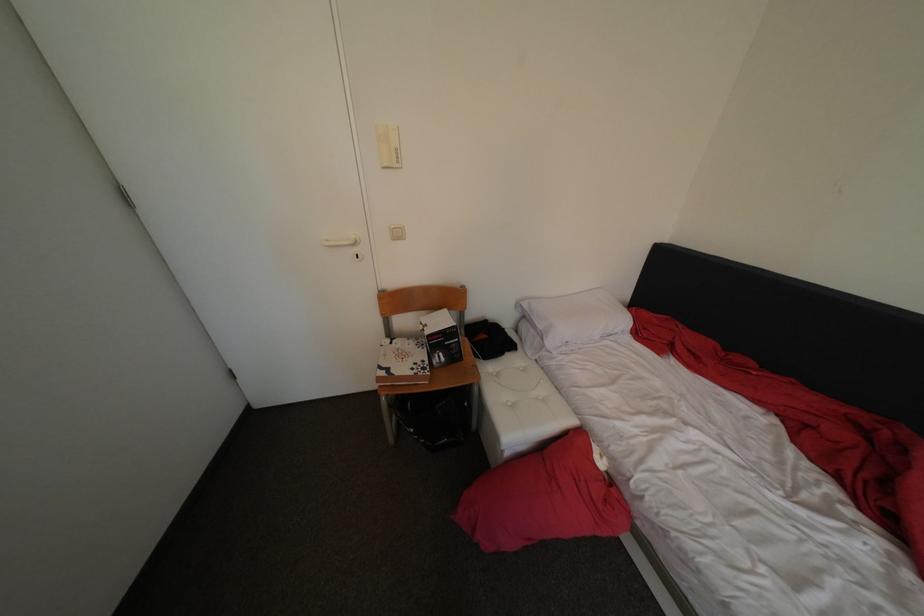
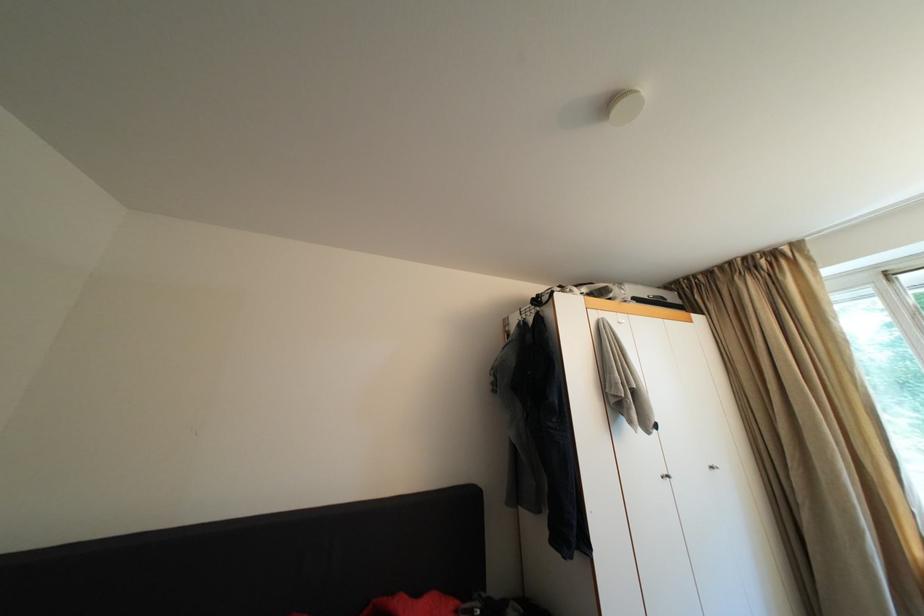
Question: The camera is either moving clockwise (left) or counter-clockwise (right) around the object. The first image is from the beginning of the video and the second image is from the end. Is the camera moving left or right when shooting the video?

Choices:
 (A) Left
 (B) Right

Answer: (A)